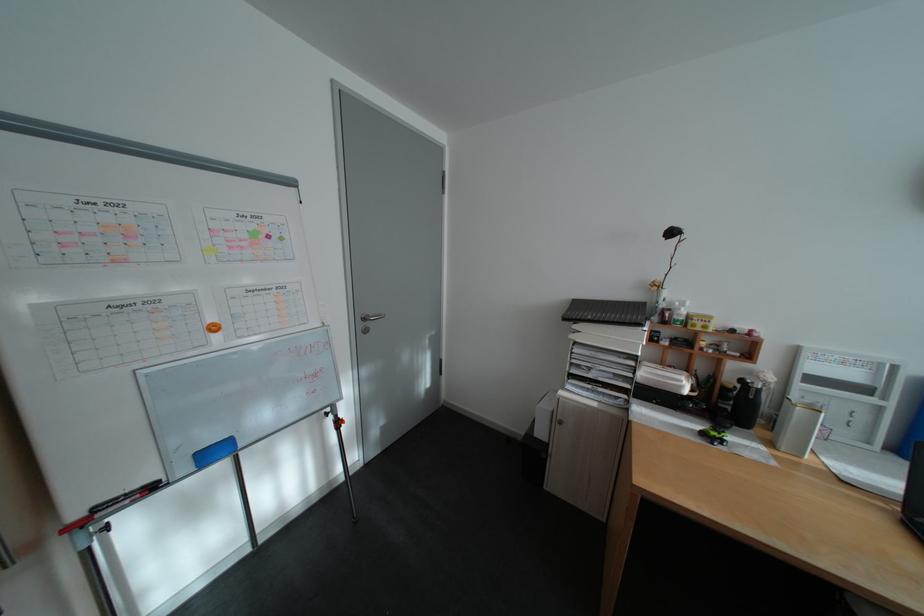
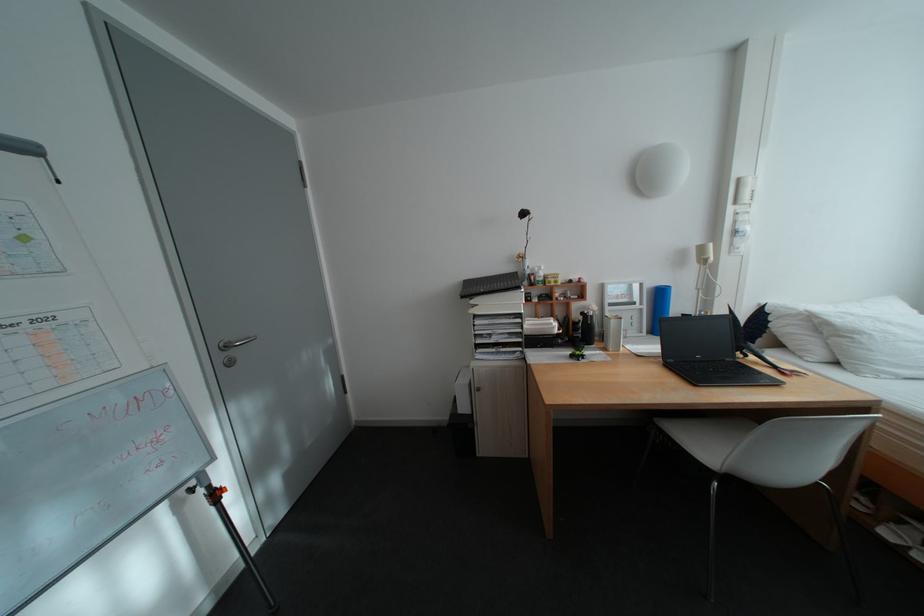
Question: How did the camera likely rotate?

Choices:
 (A) Left
 (B) Right
 (C) Up
 (D) Down

Answer: (B)